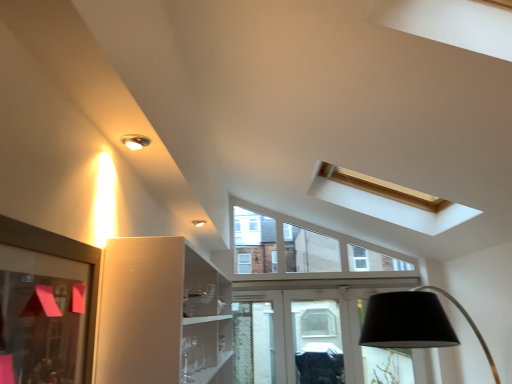
Question: In the image, is matte glass picture frame at left positioned in front of or behind matte silver light fixture at upper left?

Choices:
 (A) front
 (B) behind

Answer: (A)

Question: Is point (1, 220) closer or farther from the camera than point (143, 145)?

Choices:
 (A) closer
 (B) farther

Answer: (A)

Question: Considering the positions of matte glass picture frame at left and matte silver light fixture at upper left in the image, is matte glass picture frame at left taller or shorter than matte silver light fixture at upper left?

Choices:
 (A) tall
 (B) short

Answer: (A)

Question: Is matte silver light fixture at upper left wider or thinner than matte glass picture frame at left?

Choices:
 (A) thin
 (B) wide

Answer: (B)

Question: From a real-world perspective, is matte silver light fixture at upper left above or below matte glass picture frame at left?

Choices:
 (A) below
 (B) above

Answer: (B)

Question: From the image's perspective, relative to matte glass picture frame at left, is matte silver light fixture at upper left above or below?

Choices:
 (A) below
 (B) above

Answer: (B)

Question: Which is correct: matte silver light fixture at upper left is inside matte glass picture frame at left, or outside of it?

Choices:
 (A) outside
 (B) inside

Answer: (A)